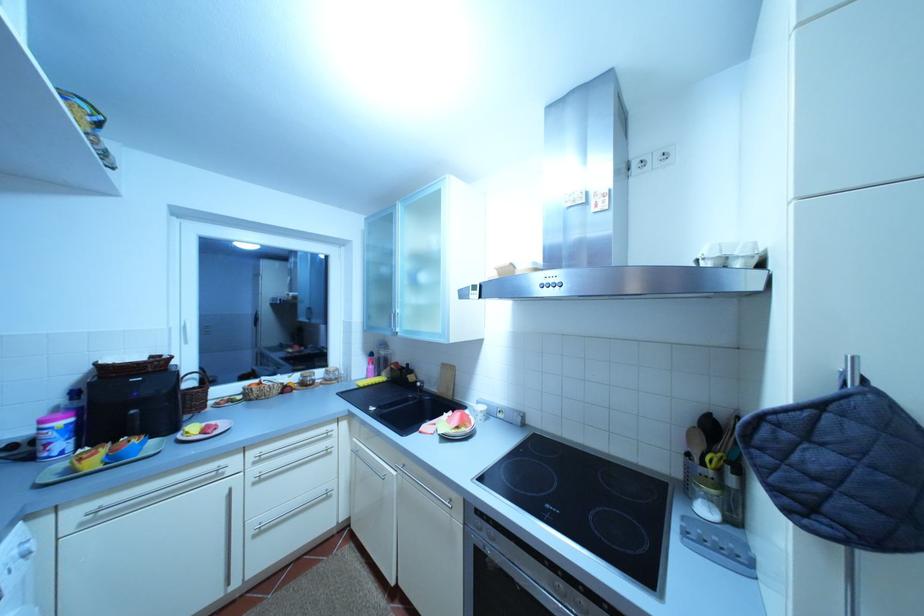
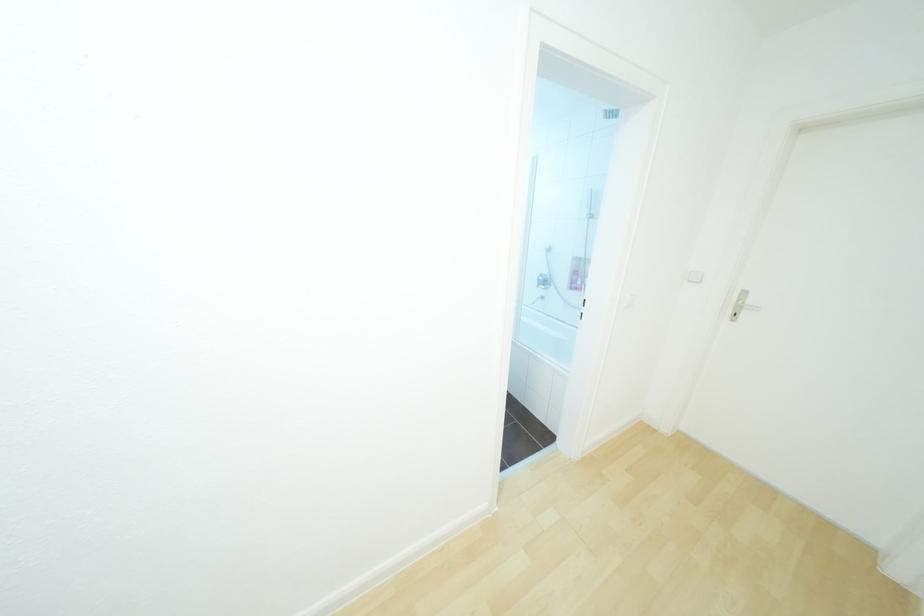
Question: What movement of the cameraman would produce the second image?

Choices:
 (A) Left
 (B) Right
 (C) Forward
 (D) Backward

Answer: (B)